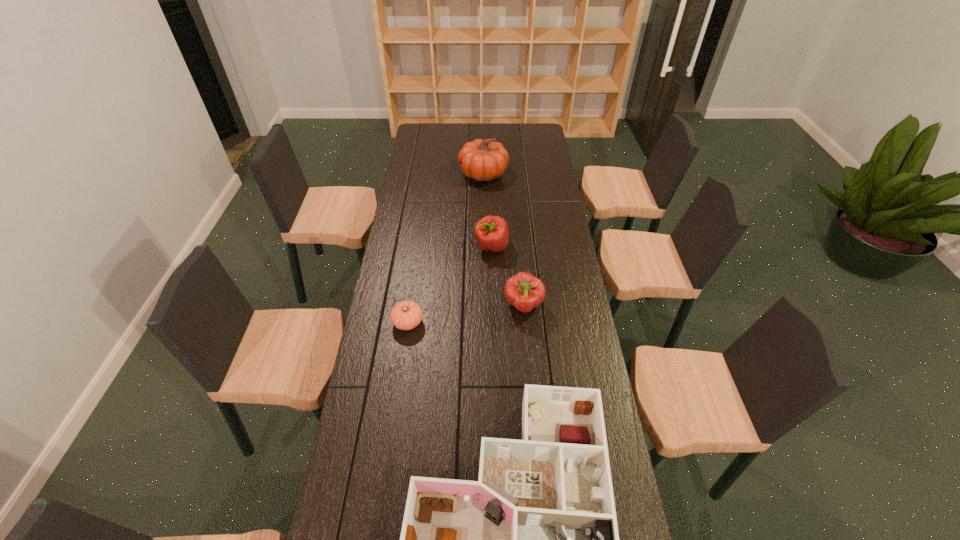
Locate an element on the screen. the tallest object is located at coordinates (482, 160).

Identify the location of the farthest object. (482, 160).

The image size is (960, 540). In order to click on the fourth nearest object in this screenshot , I will do 491,232.

Identify the location of the nearer bell pepper. (523, 291).

Identify the location of the leftmost object. The image size is (960, 540). (406, 315).

Locate an element on the screen. The width and height of the screenshot is (960, 540). tomato is located at coordinates (406, 315).

The width and height of the screenshot is (960, 540). What are the coordinates of `free space located 0.070m on the face of the tallest object` in the screenshot? It's located at (444, 174).

Locate an element on the screen. This screenshot has width=960, height=540. free space located 0.230m on the face of the tallest object is located at coordinates (413, 174).

Identify the location of free region located on the face of the tallest object. This screenshot has height=540, width=960. (415, 174).

I want to click on free point located on the back of the second farthest object, so pos(491,202).